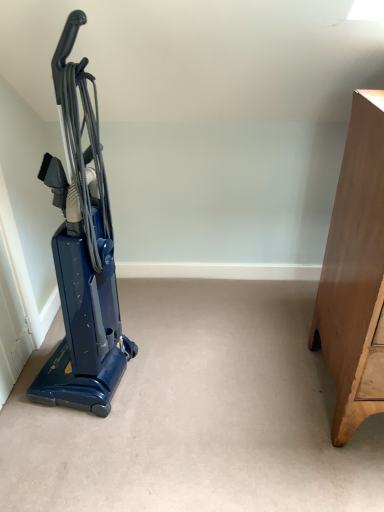
This screenshot has height=512, width=384. Find the location of `light brown wooden dresser at right`. light brown wooden dresser at right is located at coordinates coord(355,274).

What is the approximate width of light brown wooden dresser at right?

The width of light brown wooden dresser at right is 21.64 inches.

What do you see at coordinates (355, 274) in the screenshot?
I see `light brown wooden dresser at right` at bounding box center [355, 274].

What do you see at coordinates (82, 252) in the screenshot? I see `blue glossy vacuum cleaner at left` at bounding box center [82, 252].

Locate an element on the screen. The width and height of the screenshot is (384, 512). blue glossy vacuum cleaner at left is located at coordinates (82, 252).

Find the location of a particular element. The image size is (384, 512). light brown wooden dresser at right is located at coordinates coord(355,274).

Consider the image. Which object is positioned more to the right, light brown wooden dresser at right or blue glossy vacuum cleaner at left?

Positioned to the right is light brown wooden dresser at right.

Is light brown wooden dresser at right further to the viewer compared to blue glossy vacuum cleaner at left?

No, it is not.

Considering the positions of point (361, 330) and point (97, 164), is point (361, 330) closer or farther from the camera than point (97, 164)?

Point (361, 330) is closer to the camera than point (97, 164).

From the image's perspective, is light brown wooden dresser at right positioned above or below blue glossy vacuum cleaner at left?

From the image's perspective, light brown wooden dresser at right appears below blue glossy vacuum cleaner at left.

From a real-world perspective, relative to blue glossy vacuum cleaner at left, is light brown wooden dresser at right vertically above or below?

Clearly, from a real-world perspective, light brown wooden dresser at right is below blue glossy vacuum cleaner at left.

Considering the sizes of light brown wooden dresser at right and blue glossy vacuum cleaner at left in the image, is light brown wooden dresser at right wider or thinner than blue glossy vacuum cleaner at left?

Clearly, light brown wooden dresser at right has more width compared to blue glossy vacuum cleaner at left.

Can you confirm if light brown wooden dresser at right is shorter than blue glossy vacuum cleaner at left?

Correct, light brown wooden dresser at right is not as tall as blue glossy vacuum cleaner at left.

Considering the relative sizes of light brown wooden dresser at right and blue glossy vacuum cleaner at left in the image provided, is light brown wooden dresser at right smaller than blue glossy vacuum cleaner at left?

No.

Is light brown wooden dresser at right completely or partially outside of blue glossy vacuum cleaner at left?

Yes.

Is light brown wooden dresser at right next to blue glossy vacuum cleaner at left?

No, light brown wooden dresser at right is not in contact with blue glossy vacuum cleaner at left.

Is light brown wooden dresser at right oriented away from blue glossy vacuum cleaner at left?

No, light brown wooden dresser at right's orientation is not away from blue glossy vacuum cleaner at left.

How different are the orientations of light brown wooden dresser at right and blue glossy vacuum cleaner at left in degrees?

light brown wooden dresser at right and blue glossy vacuum cleaner at left are facing 82.9 degrees away from each other.

Image resolution: width=384 pixels, height=512 pixels. I want to click on furniture on the right of the blue glossy vacuum cleaner at left, so click(355, 274).

Is blue glossy vacuum cleaner at left to the left of light brown wooden dresser at right from the viewer's perspective?

Yes.

Which object is more forward, blue glossy vacuum cleaner at left or light brown wooden dresser at right?

light brown wooden dresser at right is more forward.

Between point (81, 281) and point (363, 184), which one is positioned behind?

Positioned behind is point (81, 281).

Looking at this image, from the image's perspective, is blue glossy vacuum cleaner at left located beneath light brown wooden dresser at right?

No, from the image's perspective, blue glossy vacuum cleaner at left is not below light brown wooden dresser at right.

From a real-world perspective, is blue glossy vacuum cleaner at left physically above light brown wooden dresser at right?

Yes, from a real-world perspective, blue glossy vacuum cleaner at left is above light brown wooden dresser at right.

Is blue glossy vacuum cleaner at left wider or thinner than light brown wooden dresser at right?

Clearly, blue glossy vacuum cleaner at left has less width compared to light brown wooden dresser at right.

In the scene shown: Can you confirm if blue glossy vacuum cleaner at left is taller than light brown wooden dresser at right?

Correct, blue glossy vacuum cleaner at left is much taller as light brown wooden dresser at right.

Based on the photo, who is bigger, blue glossy vacuum cleaner at left or light brown wooden dresser at right?

Bigger between the two is light brown wooden dresser at right.

Is blue glossy vacuum cleaner at left surrounding light brown wooden dresser at right?

No, light brown wooden dresser at right is not inside blue glossy vacuum cleaner at left.

Is blue glossy vacuum cleaner at left touching light brown wooden dresser at right?

No.

Is blue glossy vacuum cleaner at left oriented towards light brown wooden dresser at right?

Yes, blue glossy vacuum cleaner at left is aimed at light brown wooden dresser at right.

You are a GUI agent. You are given a task and a screenshot of the screen. Output one action in this format:
    pyautogui.click(x=<x>, y=<y>)
    Task: Click on the home appliance that is above the light brown wooden dresser at right (from the image's perspective)
    
    Given the screenshot: What is the action you would take?
    pyautogui.click(x=82, y=252)

Find the location of a particular element. furniture in front of the blue glossy vacuum cleaner at left is located at coordinates (355, 274).

Find the location of `home appliance behind the light brown wooden dresser at right`. home appliance behind the light brown wooden dresser at right is located at coordinates [x=82, y=252].